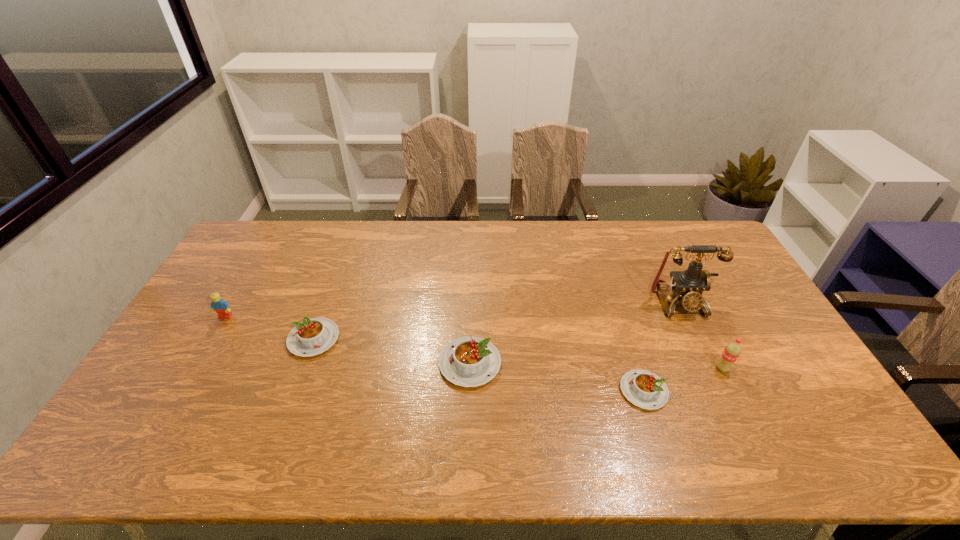
I want to click on vacant region between the telephone and the second object from left to right, so 496,321.

Find the location of a particular element. This screenshot has width=960, height=540. unoccupied area between the second shortest pudding and the tallest object is located at coordinates (496, 321).

The image size is (960, 540). I want to click on the fourth closest object to the tallest object, so click(x=311, y=337).

Locate which object is the third closest to the second shortest object. Please provide its 2D coordinates. Your answer should be formatted as a tuple, i.e. [(x, y)], where the tuple contains the x and y coordinates of a point satisfying the conditions above.

[(644, 389)]

Locate an element on the screen. This screenshot has width=960, height=540. pudding that is the second closest one to the Lego is located at coordinates (470, 361).

This screenshot has width=960, height=540. I want to click on pudding that stands as the third closest to the tallest object, so click(311, 337).

You are a GUI agent. You are given a task and a screenshot of the screen. Output one action in this format:
    pyautogui.click(x=<x>, y=<y>)
    Task: Click on the free point that satisfies the following two spatial constraints: 1. on the face of the leftmost object; 2. on the right side of the shortest object
    
    Given the screenshot: What is the action you would take?
    pyautogui.click(x=182, y=391)

Where is `vacant space that satisfies the following two spatial constraints: 1. on the face of the Lego; 2. on the left side of the rightmost pudding`? Image resolution: width=960 pixels, height=540 pixels. vacant space that satisfies the following two spatial constraints: 1. on the face of the Lego; 2. on the left side of the rightmost pudding is located at coordinates (182, 391).

Where is `free spot that satisfies the following two spatial constraints: 1. on the face of the Lego; 2. on the right side of the fifth object from right to left`? The width and height of the screenshot is (960, 540). free spot that satisfies the following two spatial constraints: 1. on the face of the Lego; 2. on the right side of the fifth object from right to left is located at coordinates (212, 339).

The image size is (960, 540). Identify the location of vacant point that satisfies the following two spatial constraints: 1. on the face of the Lego; 2. on the left side of the second pudding from right to left. (198, 363).